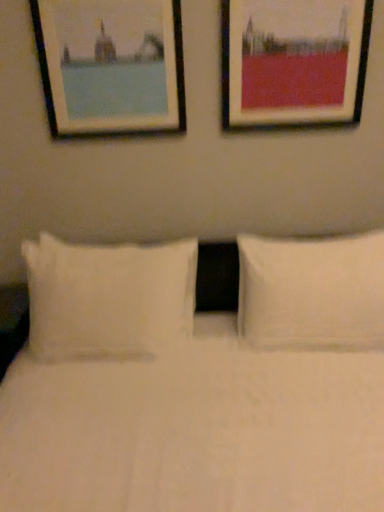
Question: Considering the positions of white soft pillow at left, the first pillow viewed from the left, and wooden frame at upper left, which is the 1th picture frame from left to right, in the image, is white soft pillow at left, the first pillow viewed from the left, taller or shorter than wooden frame at upper left, which is the 1th picture frame from left to right,?

Choices:
 (A) tall
 (B) short

Answer: (A)

Question: Is point (160, 328) positioned closer to the camera than point (51, 128)?

Choices:
 (A) closer
 (B) farther

Answer: (A)

Question: Estimate the real-world distances between objects in this image. Which object is farther from the white soft pillow at right, which appears as the 1th pillow when viewed from the right?

Choices:
 (A) matte black picture frame at upper right, the first picture frame viewed from the right
 (B) white soft pillow at left, the first pillow viewed from the left
 (C) wooden frame at upper left, which is the 1th picture frame from left to right

Answer: (C)

Question: Which is nearer to the white soft pillow at left, the first pillow viewed from the left?

Choices:
 (A) white soft pillow at right, which appears as the 1th pillow when viewed from the right
 (B) matte black picture frame at upper right, the first picture frame viewed from the right
 (C) wooden frame at upper left, which is the 1th picture frame from left to right

Answer: (A)